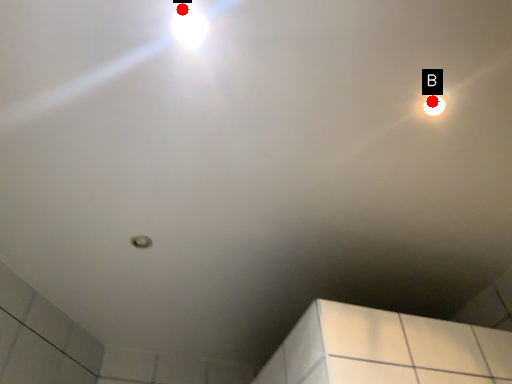
Question: Two points are circled on the image, labeled by A and B beside each circle. Which point is closer to the camera?

Choices:
 (A) A is closer
 (B) B is closer

Answer: (A)